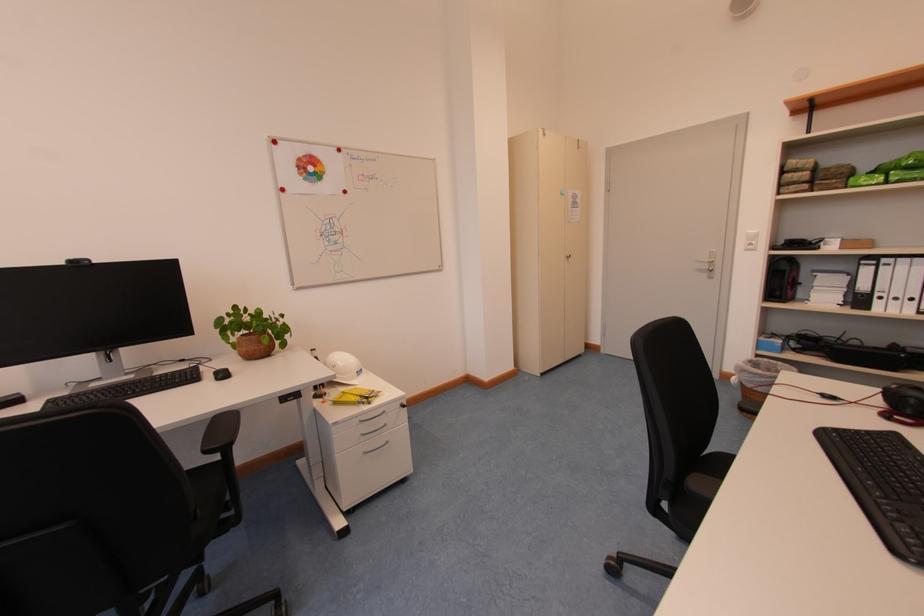
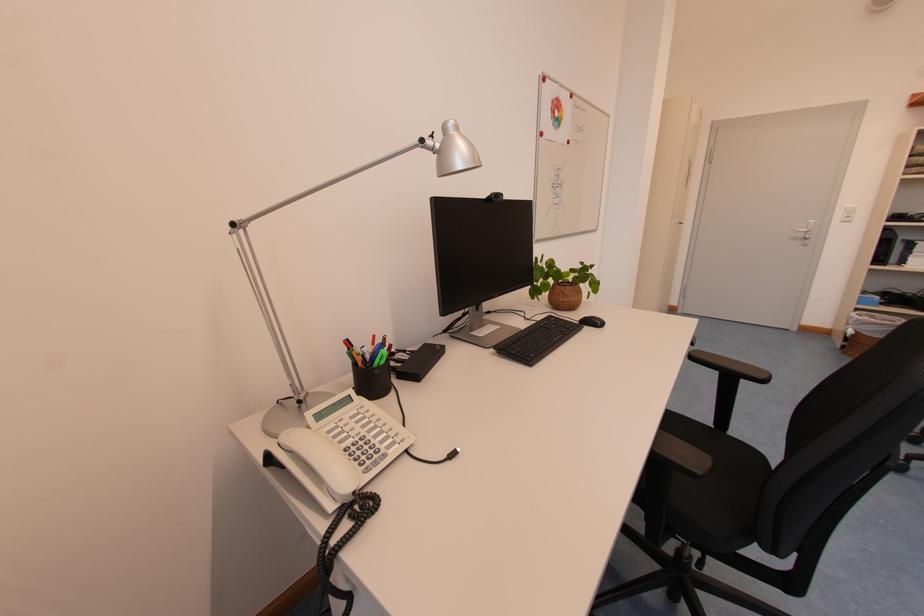
Question: Which direction would the cameraman need to move to produce the second image? Reply with the corresponding letter.

Choices:
 (A) Left
 (B) Right
 (C) Forward
 (D) Backward

Answer: (A)